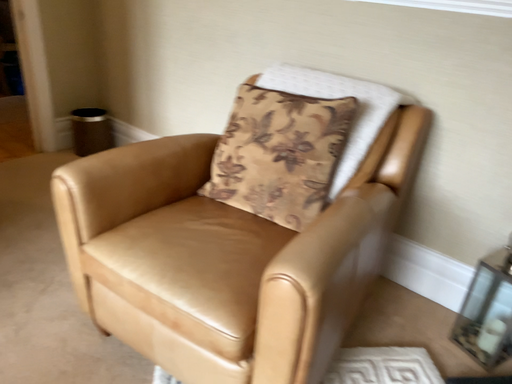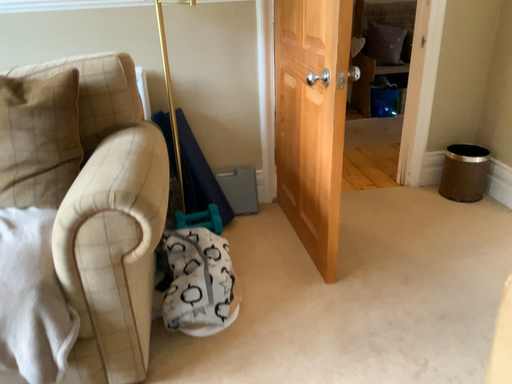
Question: Which way did the camera rotate in the video?

Choices:
 (A) rotated downward
 (B) rotated upward

Answer: (B)